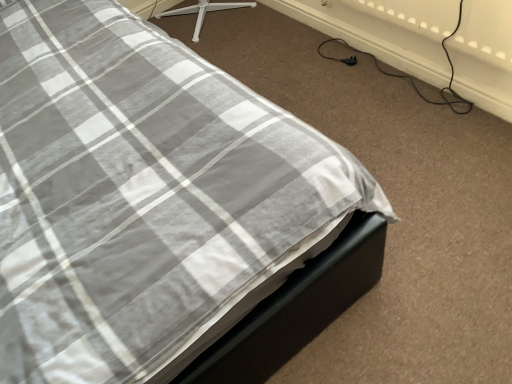
Question: Would you say black rubber cable at lower right is to the left or to the right of black plastic plug at lower right in the picture?

Choices:
 (A) right
 (B) left

Answer: (A)

Question: Does point (343, 41) appear closer or farther from the camera than point (346, 59)?

Choices:
 (A) farther
 (B) closer

Answer: (A)

Question: Do you think black rubber cable at lower right is within black plastic plug at lower right, or outside of it?

Choices:
 (A) outside
 (B) inside

Answer: (A)

Question: Looking at their shapes, would you say black plastic plug at lower right is wider or thinner than black rubber cable at lower right?

Choices:
 (A) wide
 (B) thin

Answer: (B)

Question: From a real-world perspective, is black plastic plug at lower right positioned above or below black rubber cable at lower right?

Choices:
 (A) below
 (B) above

Answer: (A)

Question: Is black plastic plug at lower right situated inside black rubber cable at lower right or outside?

Choices:
 (A) outside
 (B) inside

Answer: (A)

Question: From the image's perspective, is black plastic plug at lower right above or below black rubber cable at lower right?

Choices:
 (A) above
 (B) below

Answer: (B)